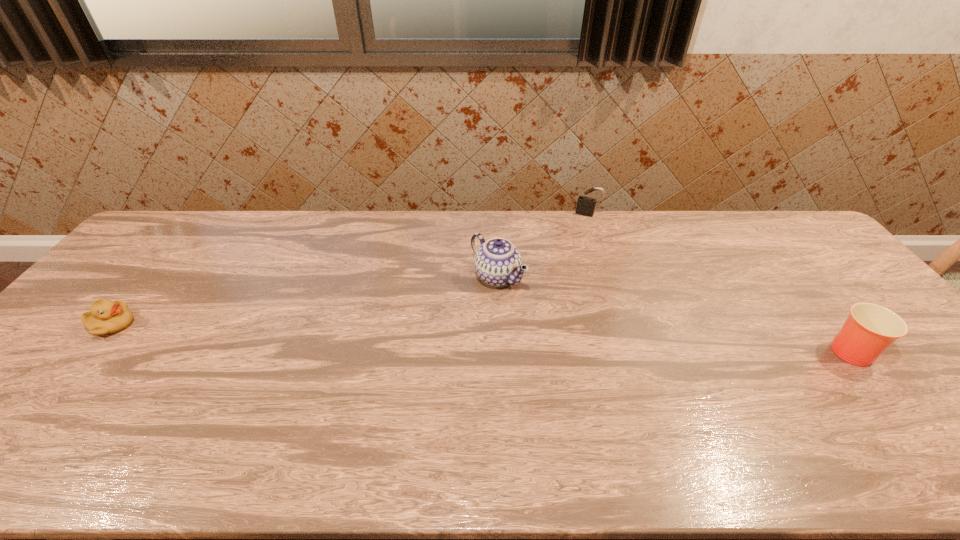
Locate an element on the screen. This screenshot has width=960, height=540. vacant space situated 0.230m at the spout of the third object from right to left is located at coordinates (410, 327).

This screenshot has width=960, height=540. What are the coordinates of `vacant space located at the spout of the third object from right to left` in the screenshot? It's located at (431, 315).

At what (x,y) coordinates should I click in order to perform the action: click on vacant space situated with the keyhole on the front of the padlock. Please return your answer as a coordinate pair (x, y). The height and width of the screenshot is (540, 960). Looking at the image, I should click on (563, 264).

The width and height of the screenshot is (960, 540). In order to click on free space located 0.280m with the keyhole on the front of the padlock in this screenshot , I will do `click(563, 264)`.

Identify the location of blank space located with the keyhole on the front of the padlock. (555, 282).

Where is `object that is positioned at the far edge`? object that is positioned at the far edge is located at coordinates (586, 205).

You are a GUI agent. You are given a task and a screenshot of the screen. Output one action in this format:
    pyautogui.click(x=<x>, y=<y>)
    Task: Click on the object that is at the left edge
    
    Given the screenshot: What is the action you would take?
    pyautogui.click(x=105, y=317)

Locate an element on the screen. The height and width of the screenshot is (540, 960). object present at the right edge is located at coordinates (870, 329).

Locate an element on the screen. This screenshot has height=540, width=960. vacant space at the far edge of the desktop is located at coordinates (420, 242).

What are the coordinates of `free spot at the left edge of the desktop` in the screenshot? It's located at (112, 288).